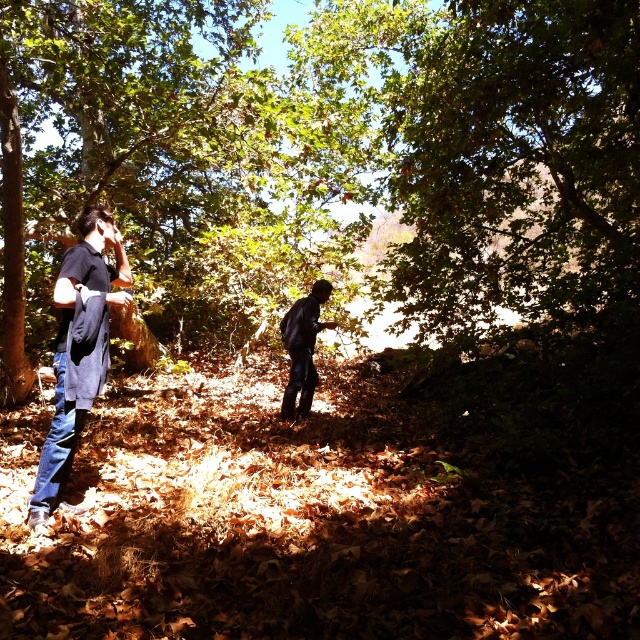
Which is behind, point (113, 241) or point (289, 385)?

Point (289, 385)

Where is `denim jacket at left`? This screenshot has height=640, width=640. denim jacket at left is located at coordinates (77, 348).